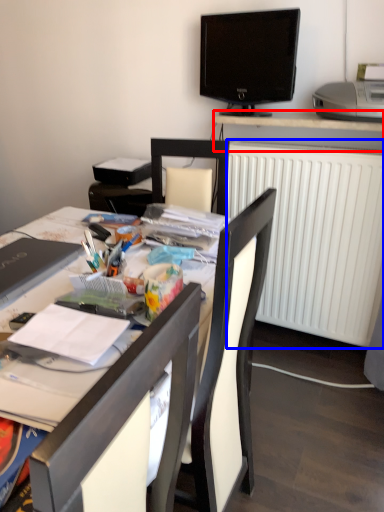
Question: Among these objects, which one is farthest to the camera, desk (highlighted by a red box) or radiator (highlighted by a blue box)?

Choices:
 (A) desk
 (B) radiator

Answer: (A)